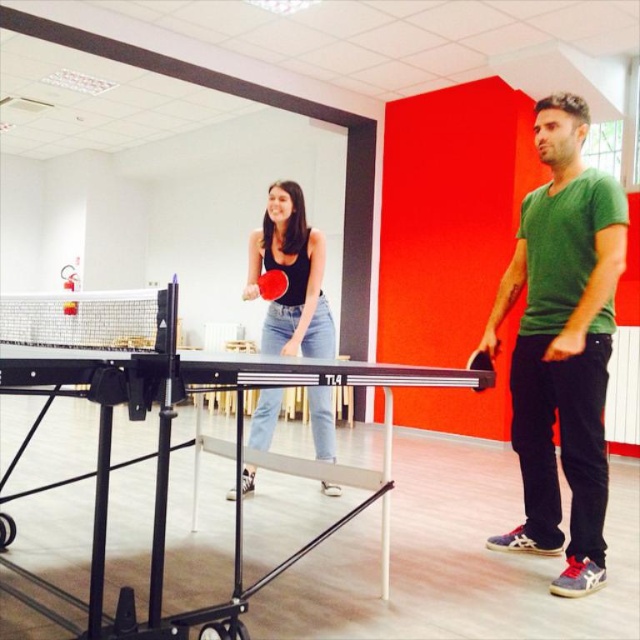
Question: Which point is closer to the camera?

Choices:
 (A) black rubber paddle at right
 (B) green matte t-shirt at right
 (C) black matte ping pong paddle at center
 (D) rubber paddle at center

Answer: (A)

Question: Which point is closer to the camera taking this photo?

Choices:
 (A) (552, 356)
 (B) (278, 410)
 (C) (472, 356)

Answer: (A)

Question: Can you confirm if green matte t-shirt at right is positioned above black matte ping pong paddle at center?

Choices:
 (A) yes
 (B) no

Answer: (A)

Question: Is black matte ping pong paddle at center below black rubber paddle at right?

Choices:
 (A) no
 (B) yes

Answer: (A)

Question: Among these points, which one is nearest to the camera?

Choices:
 (A) (320, 308)
 (B) (483, 353)

Answer: (B)

Question: Is green matte t-shirt at right above black matte ping pong paddle at center?

Choices:
 (A) no
 (B) yes

Answer: (B)